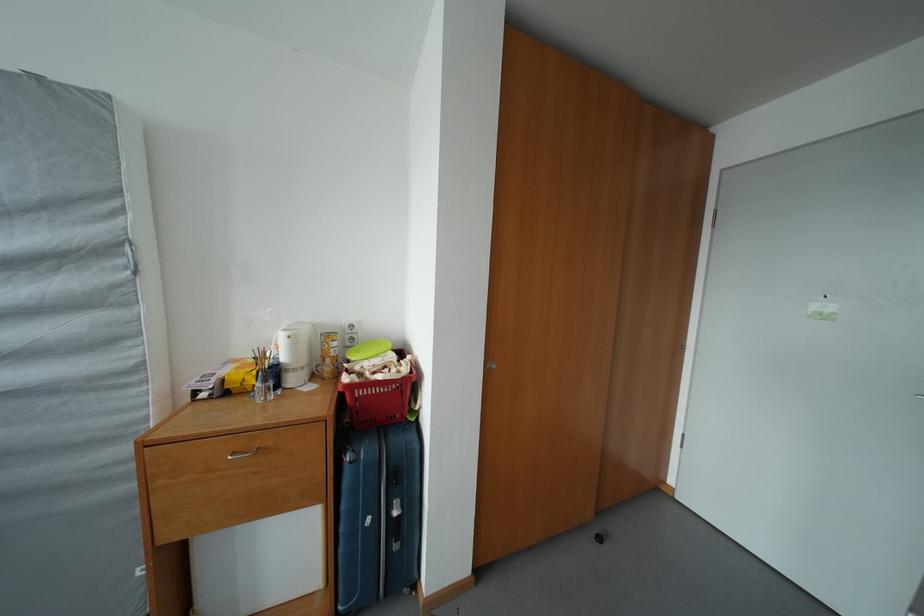
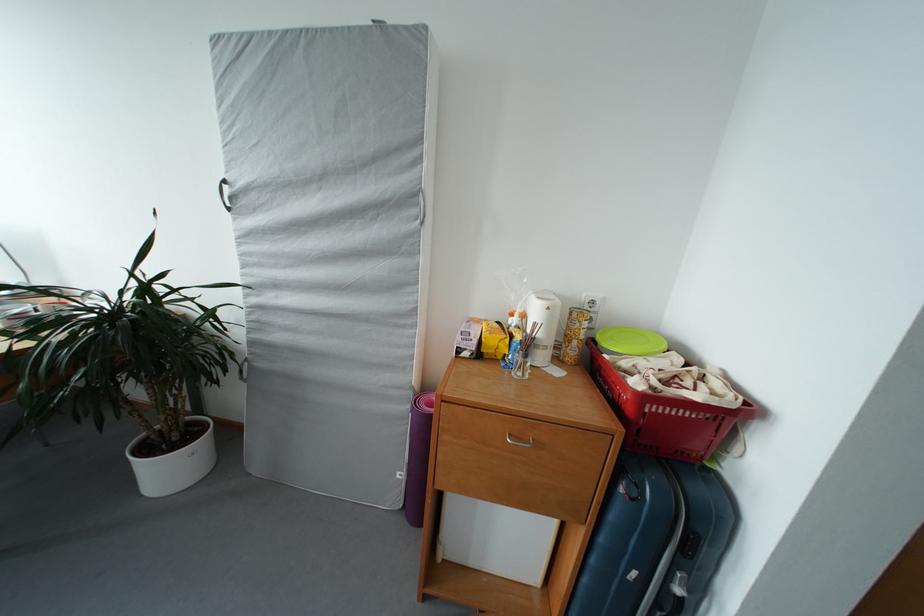
Question: The first image is from the beginning of the video and the second image is from the end. How did the camera likely rotate when shooting the video?

Choices:
 (A) Left
 (B) Right
 (C) Up
 (D) Down

Answer: (A)